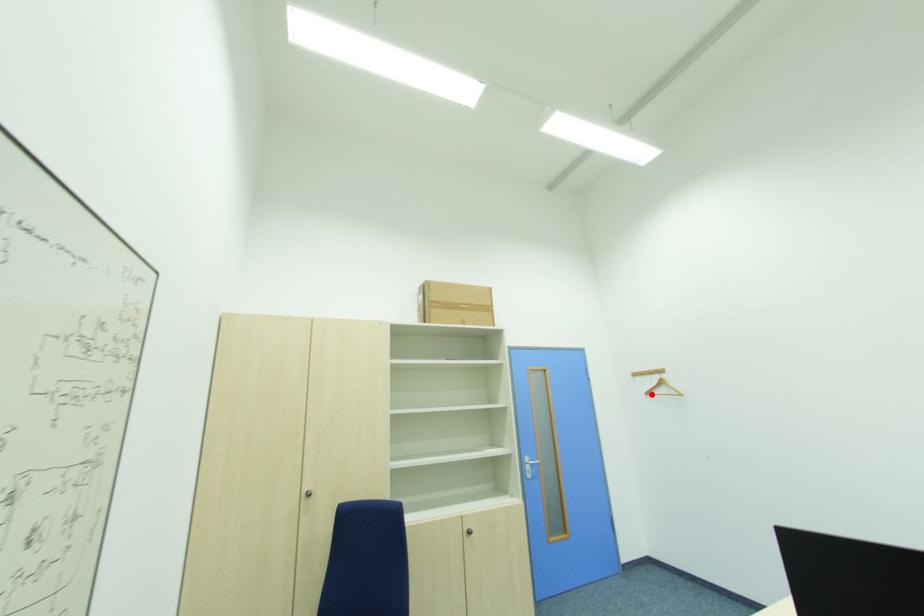
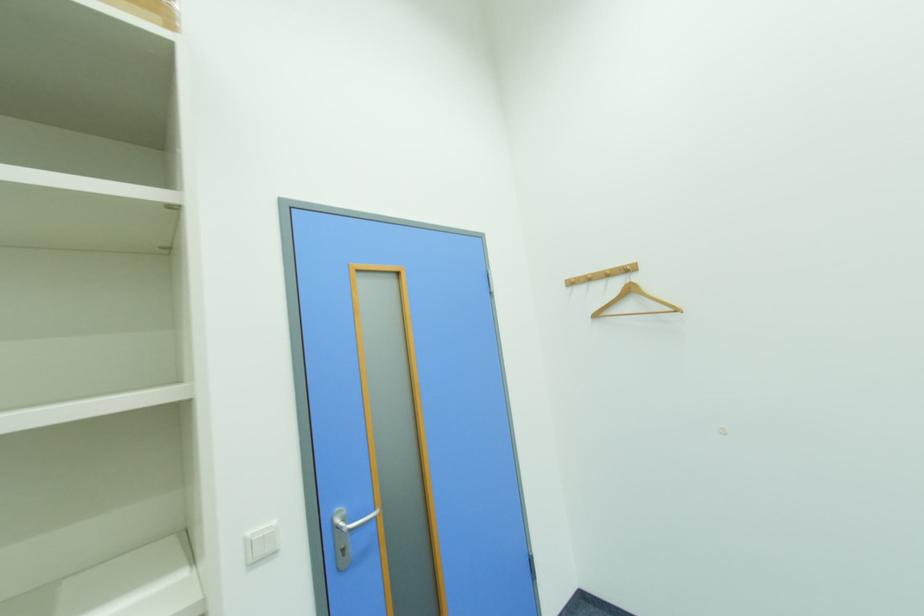
Where in the second image is the point corresponding to the highlighted location from the first image?

(601, 317)